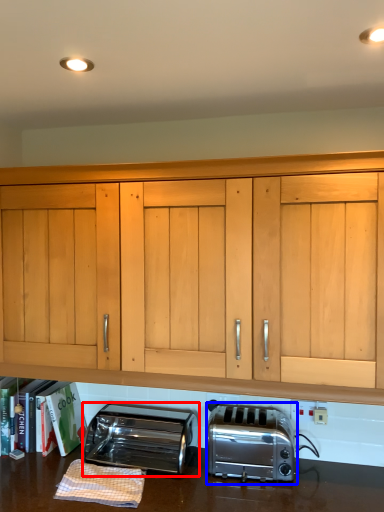
Question: Which point is further to the camera, toaster (highlighted by a red box) or toaster (highlighted by a blue box)?

Choices:
 (A) toaster
 (B) toaster

Answer: (A)